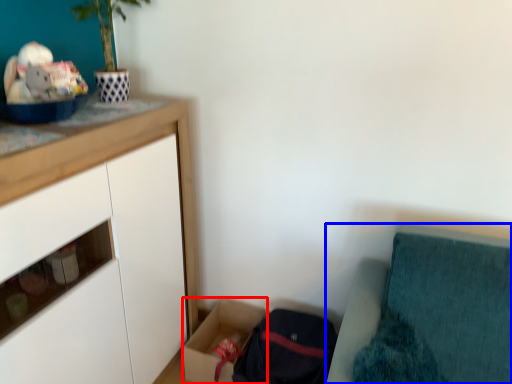
Question: Which of the following is the closest to the observer, storage box (highlighted by a red box) or furniture (highlighted by a blue box)?

Choices:
 (A) storage box
 (B) furniture

Answer: (B)